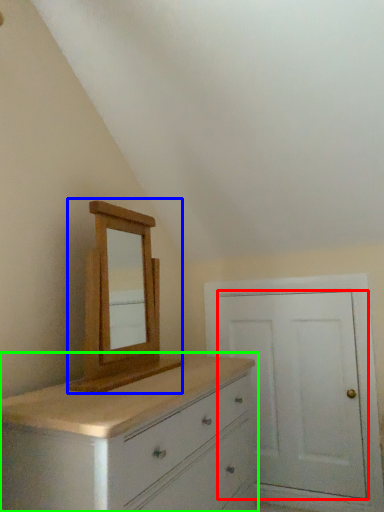
Question: Based on their relative distances, which object is farther from door (highlighted by a red box)? Choose from medicine cabinet (highlighted by a blue box) and chest of drawers (highlighted by a green box).

Choices:
 (A) medicine cabinet
 (B) chest of drawers

Answer: (A)